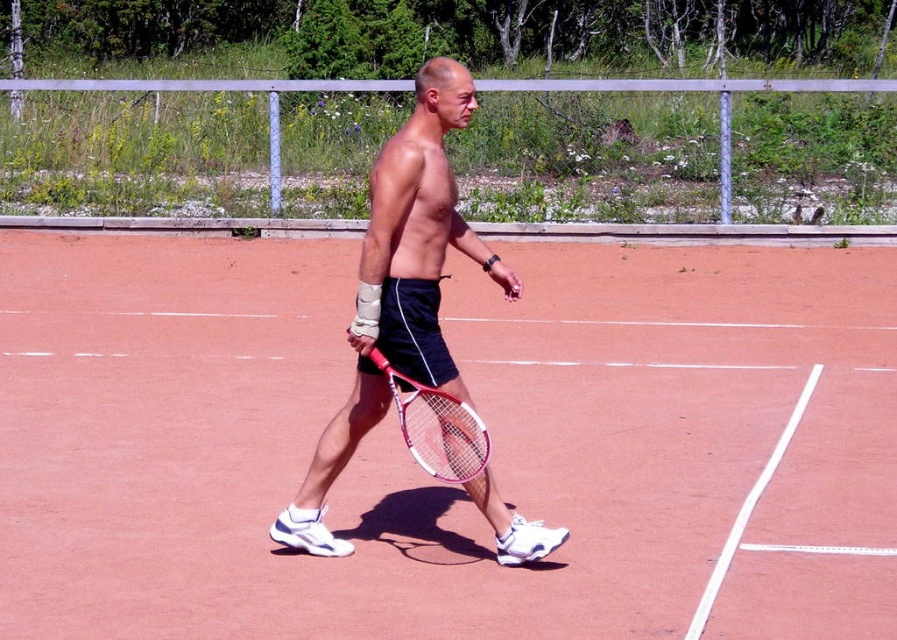
Question: Does coral clay tennis court at center have a lesser width compared to matte black shorts at center?

Choices:
 (A) no
 (B) yes

Answer: (A)

Question: Which point is closer to the camera taking this photo?

Choices:
 (A) (361, 300)
 (B) (279, 445)
 (C) (416, 456)

Answer: (C)

Question: Which of the following is the farthest from the observer?

Choices:
 (A) (699, 356)
 (B) (447, 412)

Answer: (A)

Question: Is coral clay tennis court at center smaller than matte black shorts at center?

Choices:
 (A) no
 (B) yes

Answer: (A)

Question: Which object is farther from the camera taking this photo?

Choices:
 (A) coral clay tennis court at center
 (B) white frame tennis racket at center
 (C) matte black shorts at center

Answer: (C)

Question: Does coral clay tennis court at center lie behind matte black shorts at center?

Choices:
 (A) no
 (B) yes

Answer: (A)